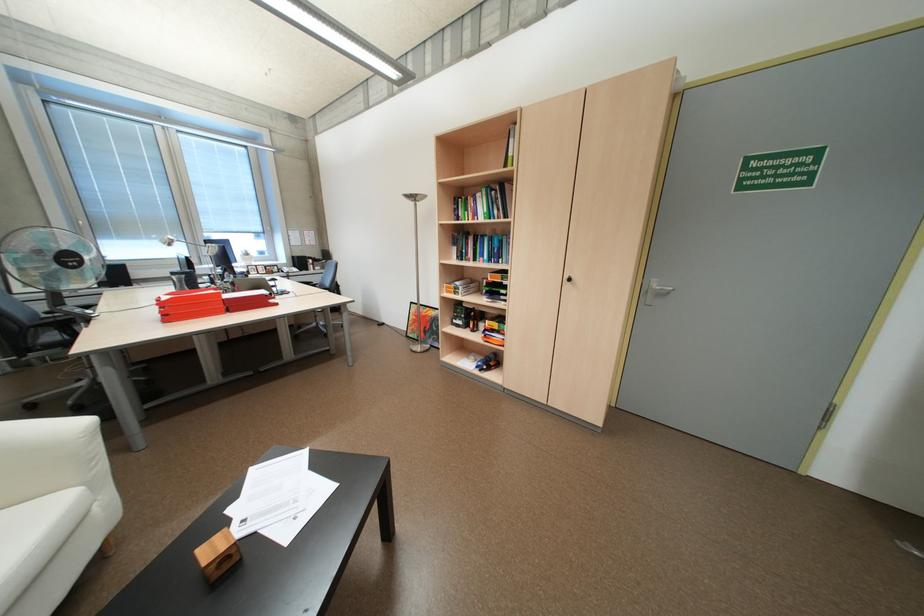
Identify the location of chair armrest. Image resolution: width=924 pixels, height=616 pixels. pyautogui.click(x=52, y=450).